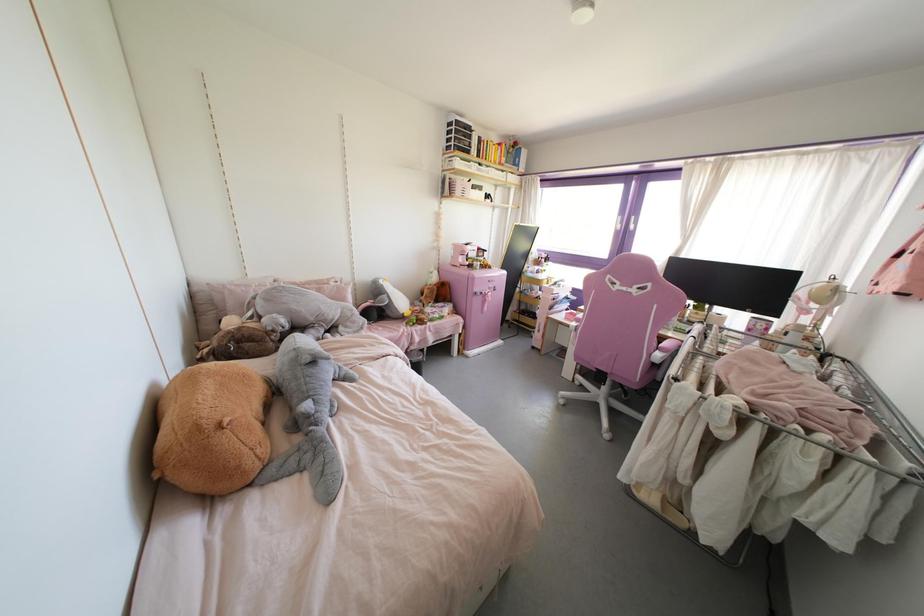
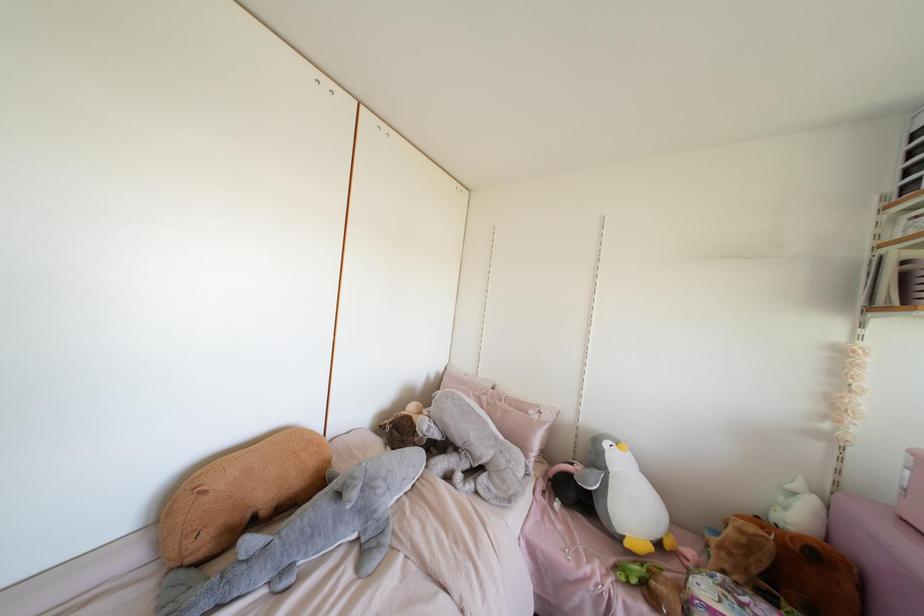
Locate, in the second image, the point that corresponds to (442,196) in the first image.

(870, 307)